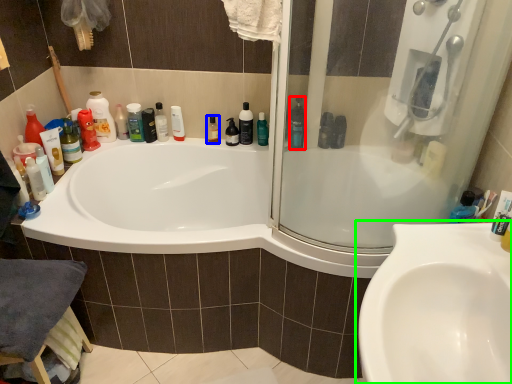
Question: Based on their relative distances, which object is farther from cleaning product (highlighted by a red box)? Choose from mouthwash (highlighted by a blue box) and sink (highlighted by a green box).

Choices:
 (A) mouthwash
 (B) sink

Answer: (A)